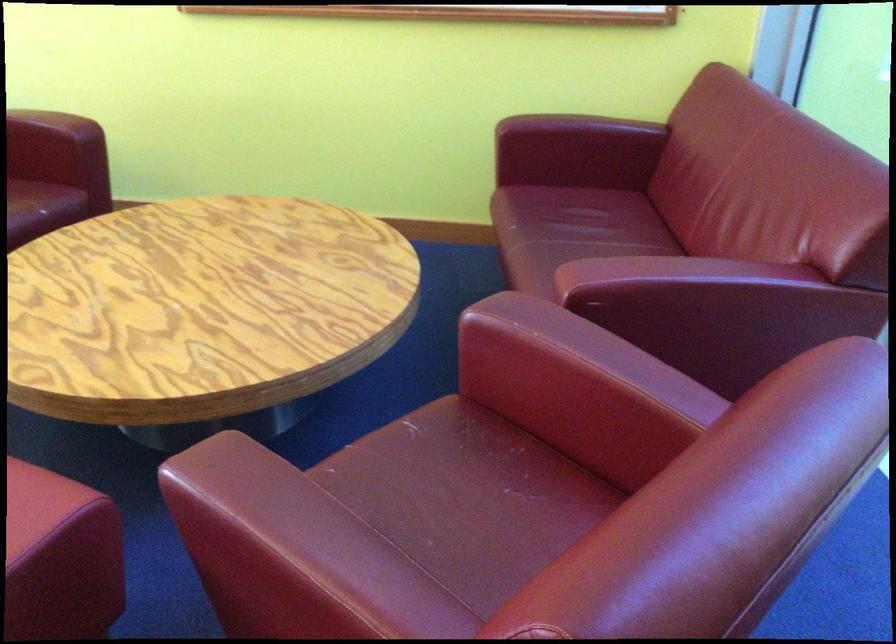
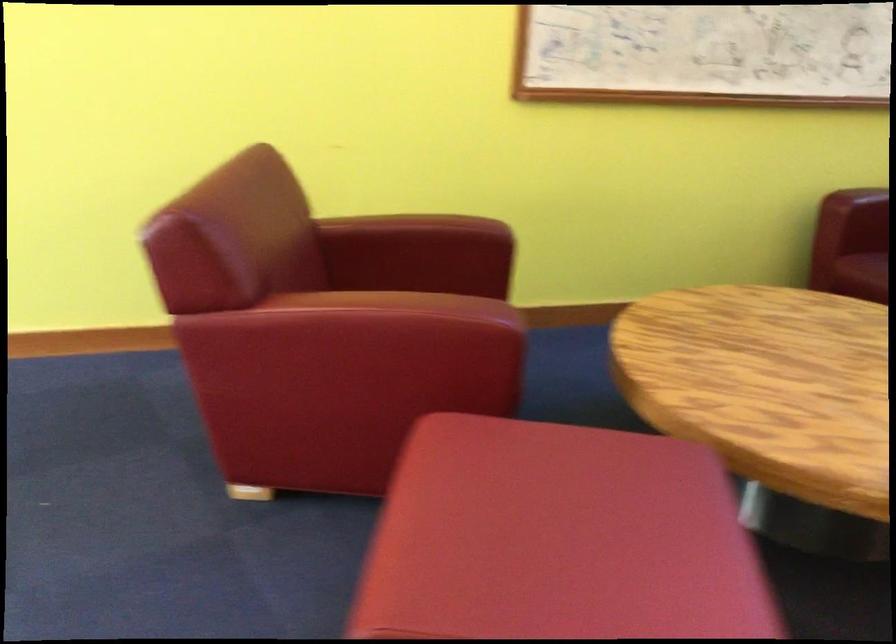
Question: I am providing you with two images of the same scene from different viewpoints. Please identify which objects are invisible in image2.

Choices:
 (A) green pump dispenser
 (B) red chair armrest
 (C) red ottoman
 (D) red chair sitting surface

Answer: (D)